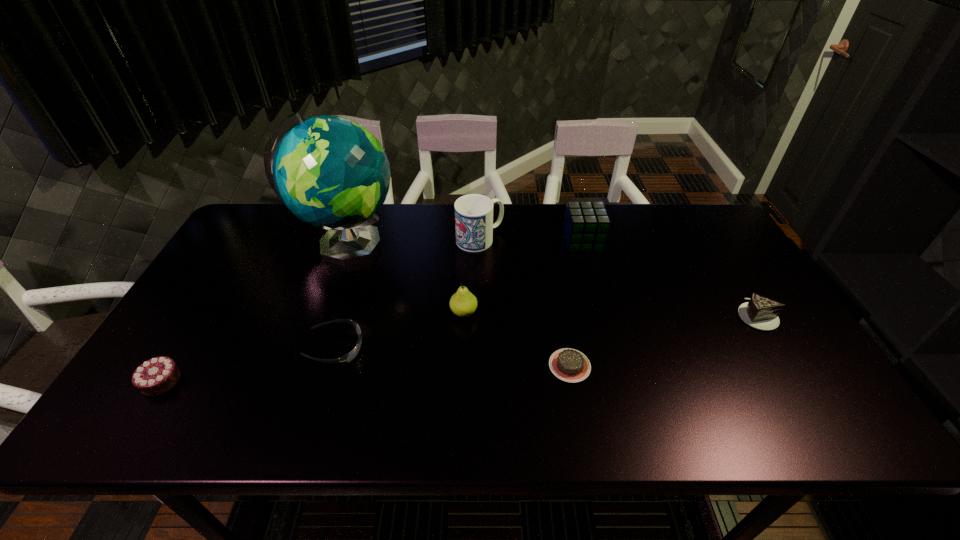
Identify the location of vacant area located on the front surface of the tallest object. (469, 246).

In order to click on vacant area situated 0.360m on the right of the mug in this screenshot , I will do tap(615, 239).

Find the location of a particular element. The height and width of the screenshot is (540, 960). free location located 0.120m on the back of the cube is located at coordinates (574, 210).

Locate an element on the screen. vacant region located 0.260m on the front of the pear is located at coordinates (460, 412).

You are a GUI agent. You are given a task and a screenshot of the screen. Output one action in this format:
    pyautogui.click(x=<x>, y=<y>)
    Task: Click on the blank space located on the back of the rightmost object
    The width and height of the screenshot is (960, 540).
    Given the screenshot: What is the action you would take?
    pyautogui.click(x=733, y=279)

This screenshot has height=540, width=960. In order to click on vacant space located on the back of the leftmost object in this screenshot , I will do `click(206, 308)`.

I want to click on blank area located on the lenses of the seventh tallest object, so click(x=400, y=348).

At what (x,y) coordinates should I click in order to perform the action: click on vacant region located on the back of the shortest chocolate cake. Please return your answer as a coordinate pair (x, y). The width and height of the screenshot is (960, 540). Looking at the image, I should click on [x=557, y=293].

Identify the location of globe at the far edge. This screenshot has height=540, width=960. (331, 172).

In order to click on mug located at the far edge in this screenshot , I will do `click(474, 225)`.